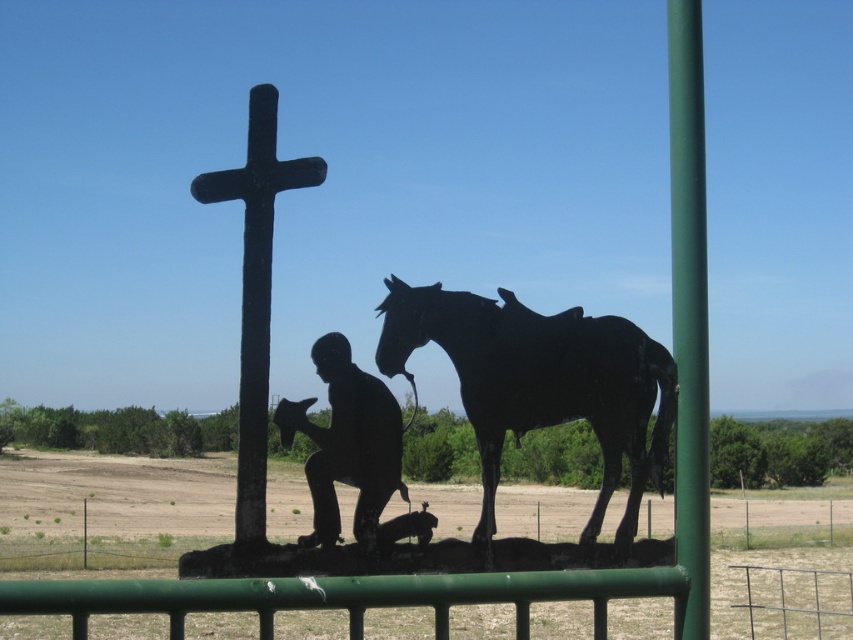
You are an artist planning to paint the sculpture scene. You want to ensure the green metallic pole at right and the black stone cross at upper center are proportionally accurate in your painting. Based on their sizes in the actual scene, which object should you depict as larger in your artwork?

The black stone cross at upper center should be depicted as larger in the artwork since it is larger than the green metallic pole at right according to the description.

You are standing in front of the silhouette sculpture and notice two points on it. The first point is at coordinates point (680, 305) and the second is at point (268, 300). Which of these two points is closer to you?

Point (680, 305) is closer to the viewer than point (268, 300).